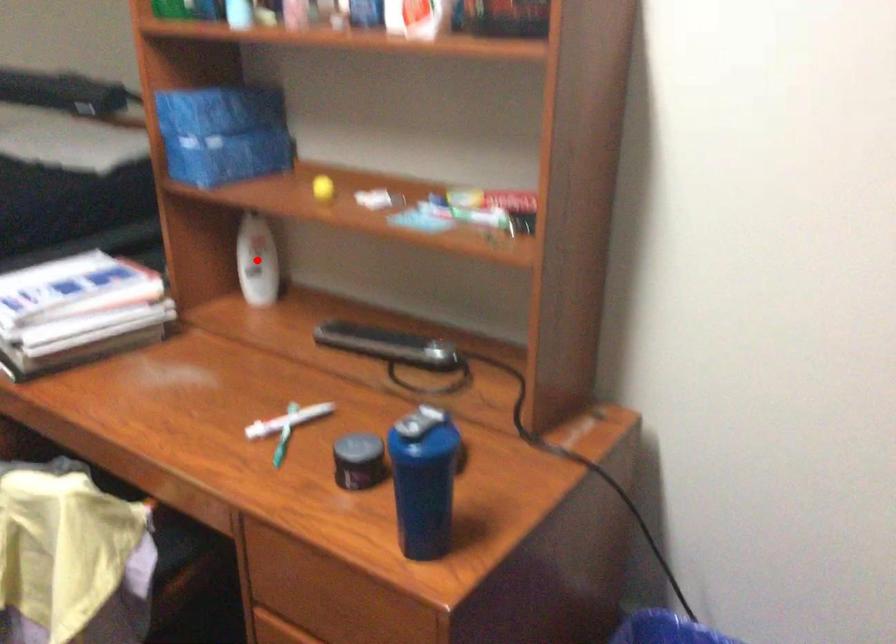
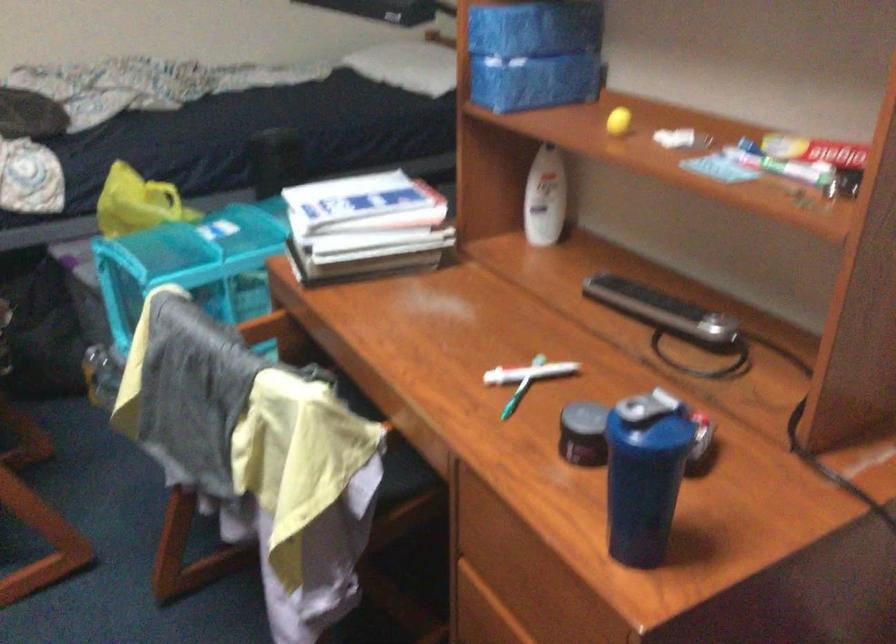
Question: I am providing you with two images of the same scene from different viewpoints. A red point is marked on the first image. Is the red point's position out of view in image 2?

Choices:
 (A) Yes
 (B) No

Answer: (B)